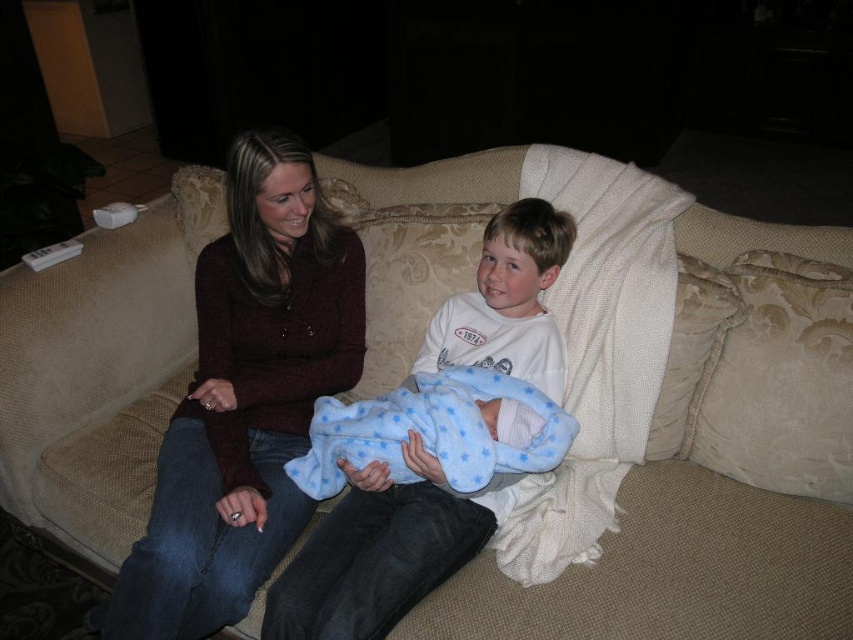
You are a photographer setting up a shoot in this living room. You need to place a small prop between the matte burgundy sweater at center and the blue fleece blanket at center. Based on their positions, which object should the prop be closer to?

The matte burgundy sweater at center is positioned on the left side of blue fleece blanket at center, so the prop should be placed closer to the blue fleece blanket at center since it is on the right side of the sweater.

You are a photographer standing at the camera position. You want to adjust the focus to the matte burgundy sweater at center. Is the sweater within the camera focus range of 4 feet?

The matte burgundy sweater at center and camera are 4.14 feet apart, so the sweater is slightly out of the camera focus range of 4 feet.

You are trying to decide which item to take with you for warmth. The matte burgundy sweater at center and the blue fleece blanket at center are both available. Which one is larger and thus better for warmth?

The matte burgundy sweater at center is bigger than the blue fleece blanket at center, so it would be better for warmth.